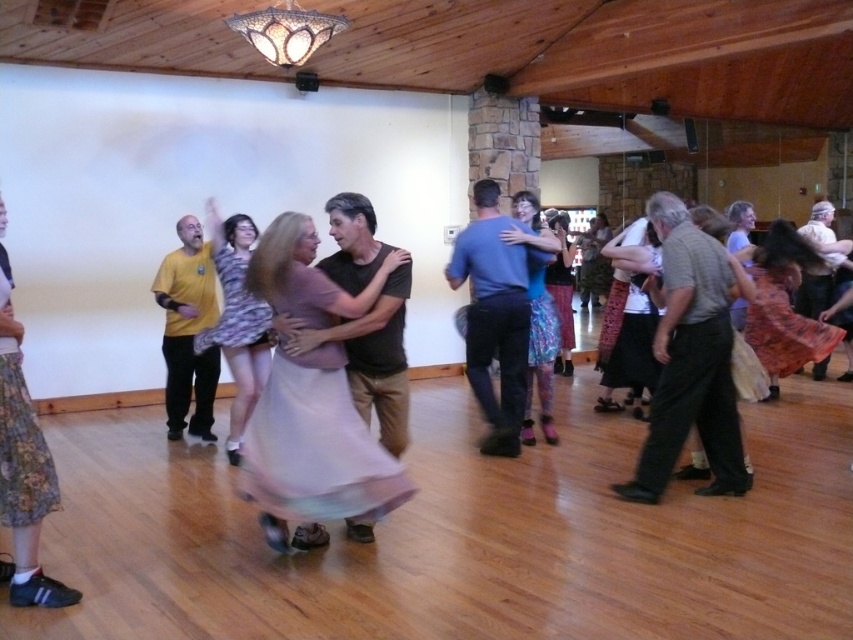
Where is `blue cotton shirt at center`? The width and height of the screenshot is (853, 640). blue cotton shirt at center is located at coordinates (496, 310).

Between point (509, 401) and point (77, 600), which one is positioned behind?

The point (509, 401) is more distant.

Locate an element on the screen. blue cotton shirt at center is located at coordinates (496, 310).